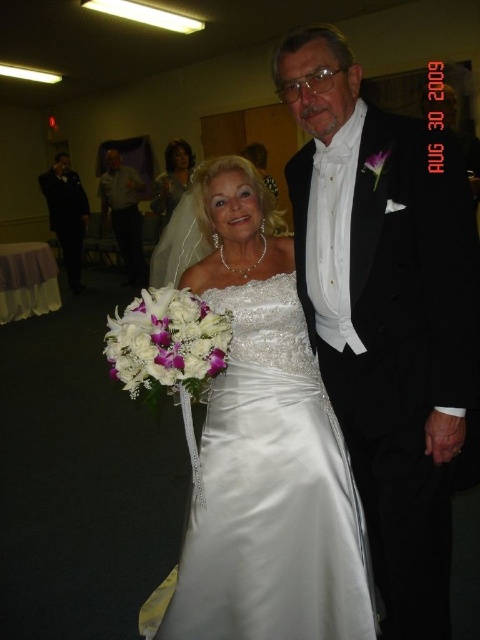
Question: Which of the following is the farthest from the observer?

Choices:
 (A) (100, 209)
 (B) (52, 205)
 (C) (288, 253)
 (D) (160, 224)

Answer: (A)

Question: Which point is farther to the camera?

Choices:
 (A) black satin tuxedo at center
 (B) black satin suit at left
 (C) satin dress at upper center
 (D) matte gray shirt at left

Answer: (B)

Question: Can you confirm if black satin tuxedo at center is positioned above satin dress at upper center?

Choices:
 (A) no
 (B) yes

Answer: (A)

Question: Can you confirm if satin dress at center is thinner than satin dress at upper center?

Choices:
 (A) yes
 (B) no

Answer: (B)

Question: Can you confirm if matte gray shirt at left is positioned to the left of satin dress at upper center?

Choices:
 (A) yes
 (B) no

Answer: (A)

Question: Which object is the closest to the satin dress at center?

Choices:
 (A) black satin tuxedo at center
 (B) matte gray shirt at left

Answer: (A)